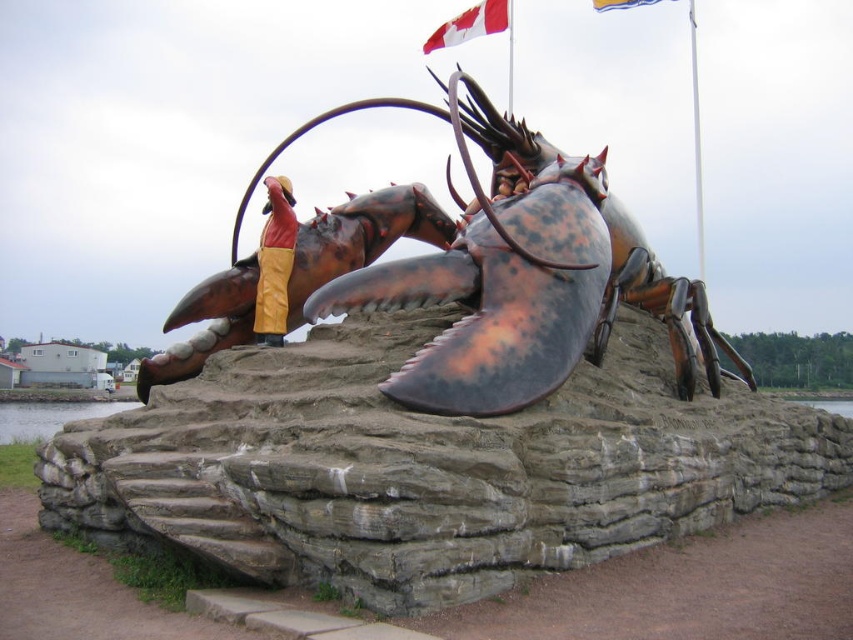
You are standing in front of the lobster sculpture and want to take a photo. There are two points marked on the sculpture. Which point is closer to you, point (251,340) or point (448,44)?

Point (251,340) is closer to the camera than point (448,44), so the point (251,340) is closer to you.

You are a visitor standing in front of the lobster sculpture. You notice the rustic copper lobster at center and the red fabric flag at upper center. Which object is located higher in the scene?

The red fabric flag at upper center is higher because it is positioned above the rustic copper lobster at center.